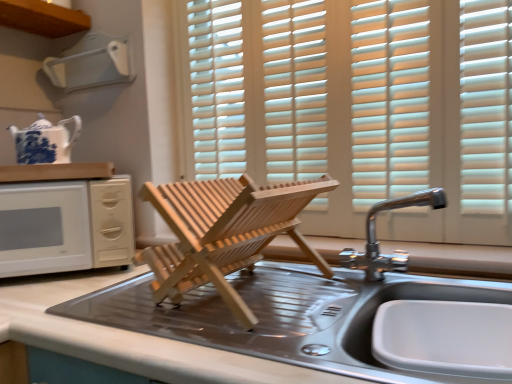
Question: From a real-world perspective, is white wood blinds at center on metallic stainless steel sink at center, which is the first countertop in right-to-left order?

Choices:
 (A) no
 (B) yes

Answer: (B)

Question: Considering the relative positions of white wood blinds at center and metallic stainless steel sink at center, which is the first countertop in right-to-left order, in the image provided, is white wood blinds at center behind metallic stainless steel sink at center, which is the first countertop in right-to-left order,?

Choices:
 (A) yes
 (B) no

Answer: (A)

Question: Does white wood blinds at center appear on the left side of metallic stainless steel sink at center, the 2th countertop from the left?

Choices:
 (A) yes
 (B) no

Answer: (B)

Question: Is white wood blinds at center far away from metallic stainless steel sink at center, the 2th countertop from the left?

Choices:
 (A) yes
 (B) no

Answer: (B)

Question: Could metallic stainless steel sink at center, which is the first countertop in bottom-to-top order, be considered to be inside white wood blinds at center?

Choices:
 (A) no
 (B) yes

Answer: (A)

Question: Considering their positions, is metallic stainless steel sink at center located in front of or behind white plastic vent at upper left?

Choices:
 (A) front
 (B) behind

Answer: (A)

Question: Looking at the image, does metallic stainless steel sink at center seem bigger or smaller compared to white plastic vent at upper left?

Choices:
 (A) big
 (B) small

Answer: (A)

Question: Considering the positions of metallic stainless steel sink at center and white plastic vent at upper left in the image, is metallic stainless steel sink at center wider or thinner than white plastic vent at upper left?

Choices:
 (A) thin
 (B) wide

Answer: (B)

Question: From a real-world perspective, is metallic stainless steel sink at center positioned above or below white plastic vent at upper left?

Choices:
 (A) above
 (B) below

Answer: (B)

Question: Considering the positions of white wood blinds at center and metallic stainless steel sink at center, which is the first countertop in bottom-to-top order, in the image, is white wood blinds at center wider or thinner than metallic stainless steel sink at center, which is the first countertop in bottom-to-top order,?

Choices:
 (A) thin
 (B) wide

Answer: (A)

Question: Is white wood blinds at center to the left or to the right of metallic stainless steel sink at center, placed as the 2th countertop when sorted from top to bottom, in the image?

Choices:
 (A) right
 (B) left

Answer: (A)

Question: Considering their positions, is white wood blinds at center located in front of or behind metallic stainless steel sink at center, the 2th countertop from the left?

Choices:
 (A) behind
 (B) front

Answer: (A)

Question: Is white wood blinds at center situated inside metallic stainless steel sink at center, placed as the 2th countertop when sorted from top to bottom, or outside?

Choices:
 (A) inside
 (B) outside

Answer: (B)

Question: Looking at the image, does chrome metallic faucet at upper right seem bigger or smaller compared to white plastic vent at upper left?

Choices:
 (A) small
 (B) big

Answer: (B)

Question: Choose the correct answer: Is chrome metallic faucet at upper right inside white plastic vent at upper left or outside it?

Choices:
 (A) inside
 (B) outside

Answer: (B)